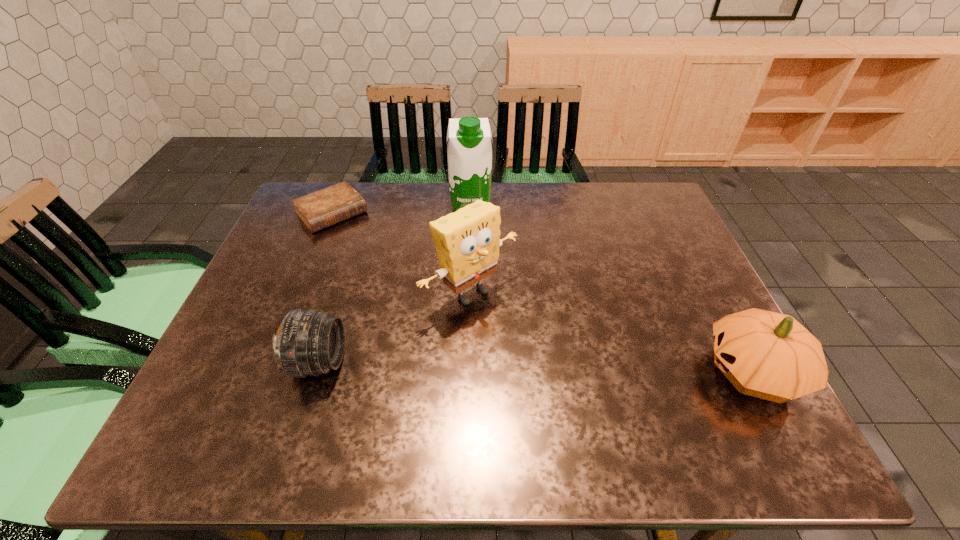
At what (x,y) coordinates should I click in order to perform the action: click on vacant space on the desktop that is between the telephoto lens and the rightmost object and is positioned on the spine side of the diary. Please return your answer as a coordinate pair (x, y). This screenshot has height=540, width=960. Looking at the image, I should click on (473, 366).

I want to click on free space on the desktop that is between the telephoto lens and the gourd and is positioned on the front-facing side of the tallest object, so click(x=480, y=366).

Where is `vacant space on the desktop that is between the telephoto lens and the gourd and is positioned on the face of the sponge`? This screenshot has height=540, width=960. vacant space on the desktop that is between the telephoto lens and the gourd and is positioned on the face of the sponge is located at coordinates (553, 367).